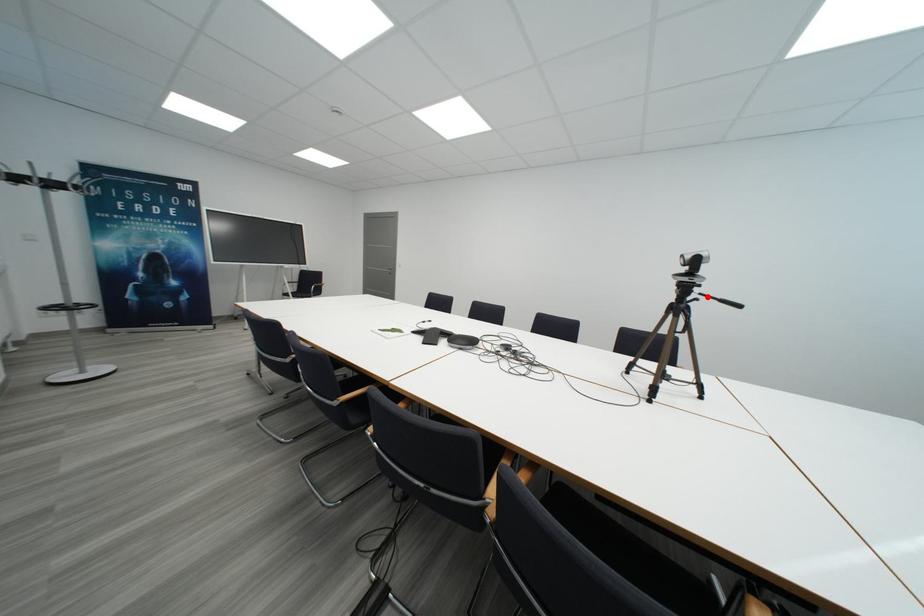
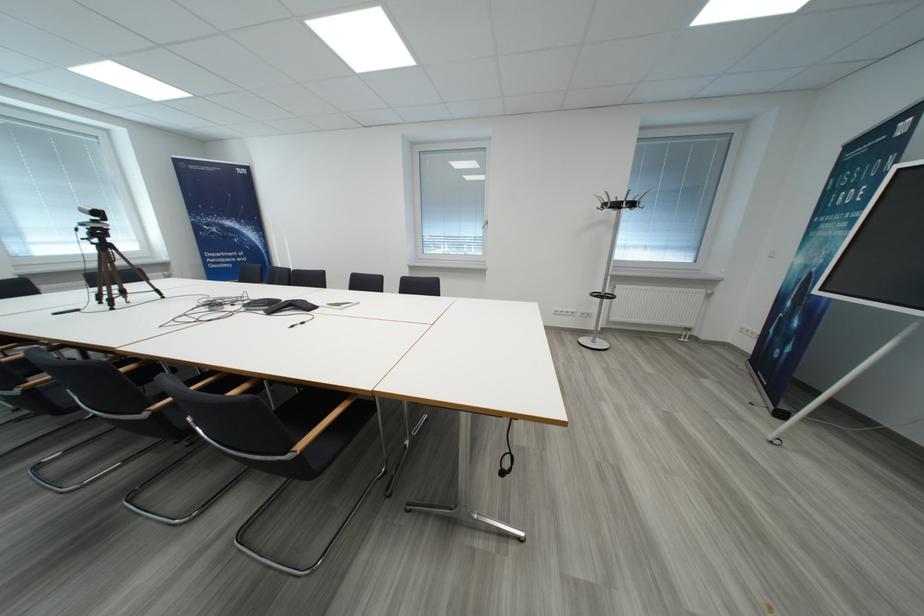
Question: I am providing you with two images of the same scene from different viewpoints. A red point is marked on the first image. At the location where the point appears in image 1, is it still visible in image 2?

Choices:
 (A) Yes
 (B) No

Answer: (B)